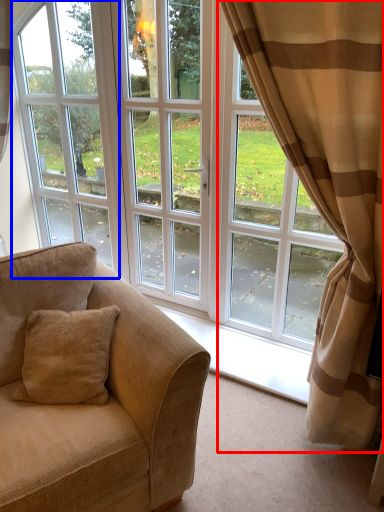
Question: Which of the following is the closest to the observer, curtain (highlighted by a red box) or window frame (highlighted by a blue box)?

Choices:
 (A) curtain
 (B) window frame

Answer: (A)